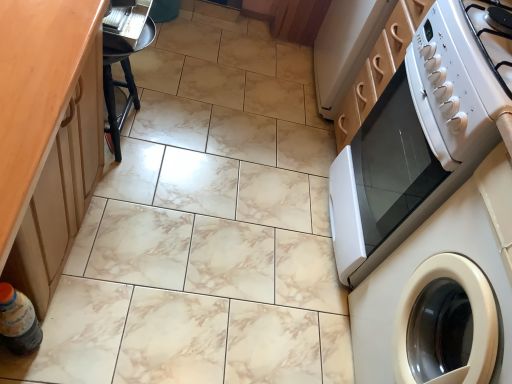
Question: Does dark brown plastic bottle at lower left appear on the right side of white glossy electric stove at upper right?

Choices:
 (A) no
 (B) yes

Answer: (A)

Question: Is dark brown plastic bottle at lower left positioned before white glossy electric stove at upper right?

Choices:
 (A) yes
 (B) no

Answer: (B)

Question: From the image's perspective, is dark brown plastic bottle at lower left beneath white glossy electric stove at upper right?

Choices:
 (A) yes
 (B) no

Answer: (A)

Question: Is dark brown plastic bottle at lower left turned away from white glossy electric stove at upper right?

Choices:
 (A) yes
 (B) no

Answer: (B)

Question: Considering the relative sizes of dark brown plastic bottle at lower left and white glossy electric stove at upper right in the image provided, is dark brown plastic bottle at lower left shorter than white glossy electric stove at upper right?

Choices:
 (A) yes
 (B) no

Answer: (B)

Question: Is dark brown plastic bottle at lower left next to white glossy electric stove at upper right?

Choices:
 (A) no
 (B) yes

Answer: (A)

Question: Is black wood bar stool at left bigger than dark brown plastic bottle at lower left?

Choices:
 (A) no
 (B) yes

Answer: (B)

Question: Would you say dark brown plastic bottle at lower left is part of black wood bar stool at left's contents?

Choices:
 (A) no
 (B) yes

Answer: (A)

Question: Is black wood bar stool at left closer to the viewer compared to dark brown plastic bottle at lower left?

Choices:
 (A) no
 (B) yes

Answer: (A)

Question: From the image's perspective, is black wood bar stool at left below dark brown plastic bottle at lower left?

Choices:
 (A) yes
 (B) no

Answer: (B)

Question: Does black wood bar stool at left appear on the right side of dark brown plastic bottle at lower left?

Choices:
 (A) yes
 (B) no

Answer: (A)

Question: Is black wood bar stool at left with dark brown plastic bottle at lower left?

Choices:
 (A) no
 (B) yes

Answer: (A)

Question: Does white glossy microwave at right have a lesser height compared to black wood bar stool at left?

Choices:
 (A) no
 (B) yes

Answer: (A)